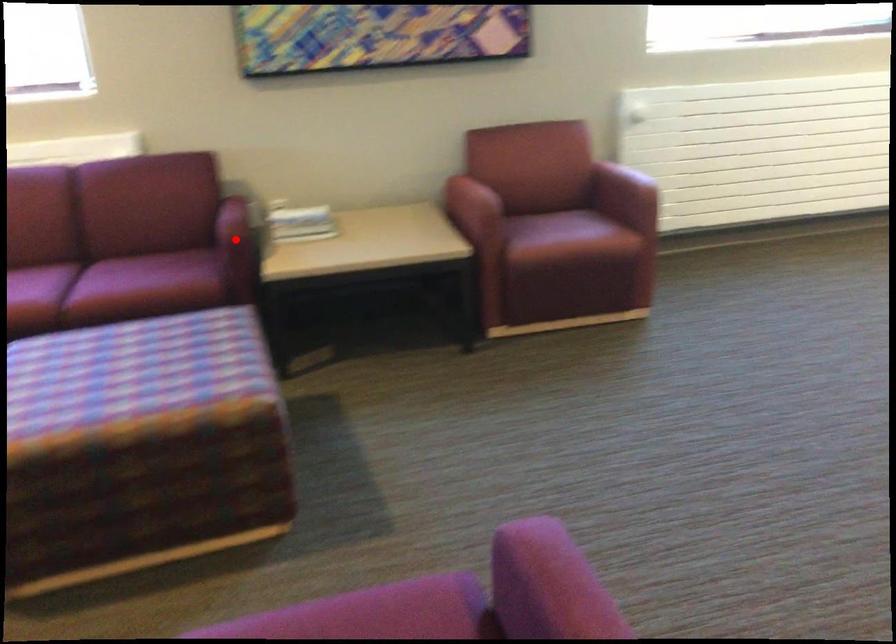
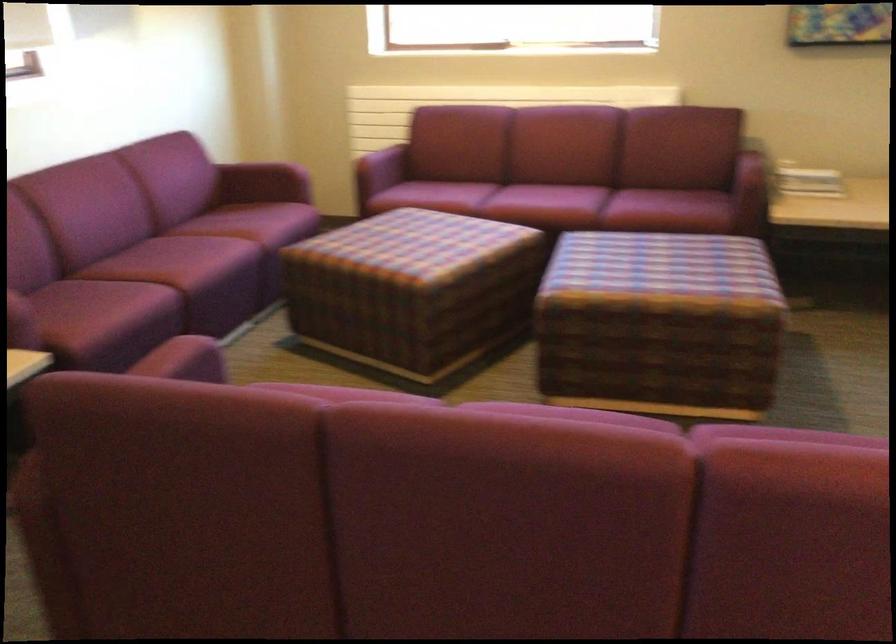
Find the pixel in the second image that matches the highlighted location in the first image.

(753, 180)